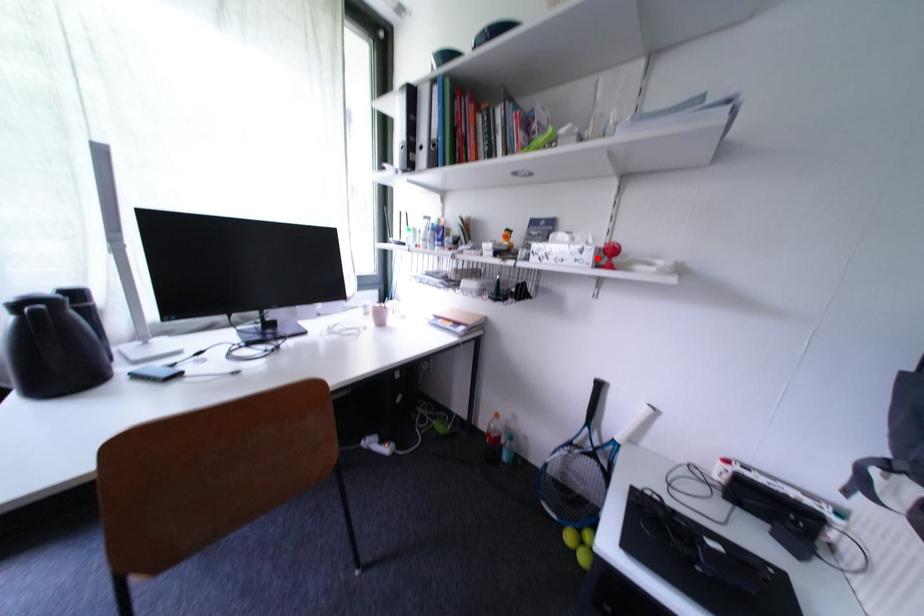
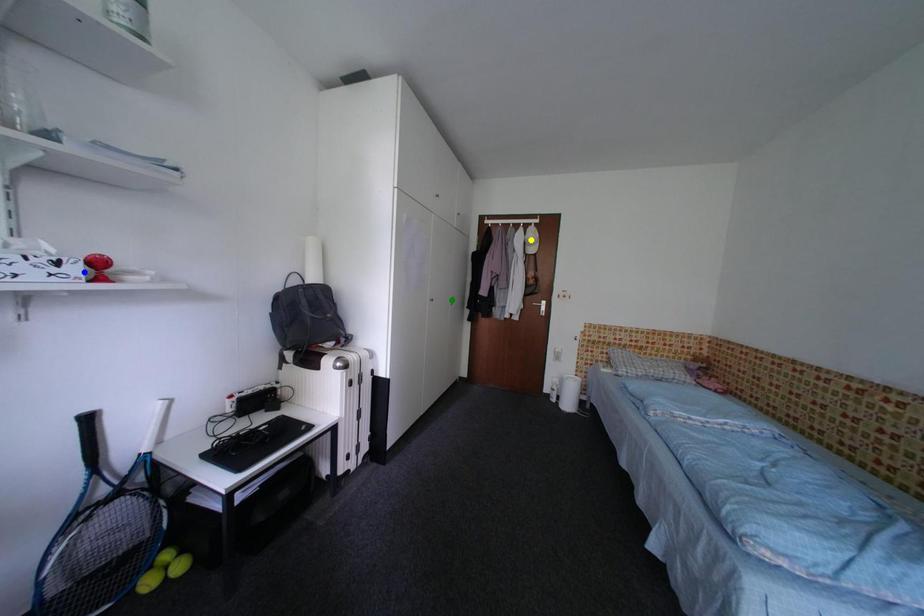
Question: I am providing you with two images of the same scene from different viewpoints. A red point is marked on the first image. You are given multiple points on the second image. Which spot in image 2 lines up with the point in image 1?

Choices:
 (A) yellow point
 (B) blue point
 (C) green point

Answer: (B)